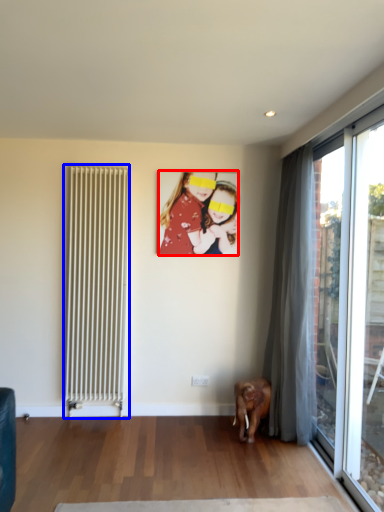
Question: Which of the following is the closest to the observer, person (highlighted by a red box) or radiator (highlighted by a blue box)?

Choices:
 (A) person
 (B) radiator

Answer: (B)